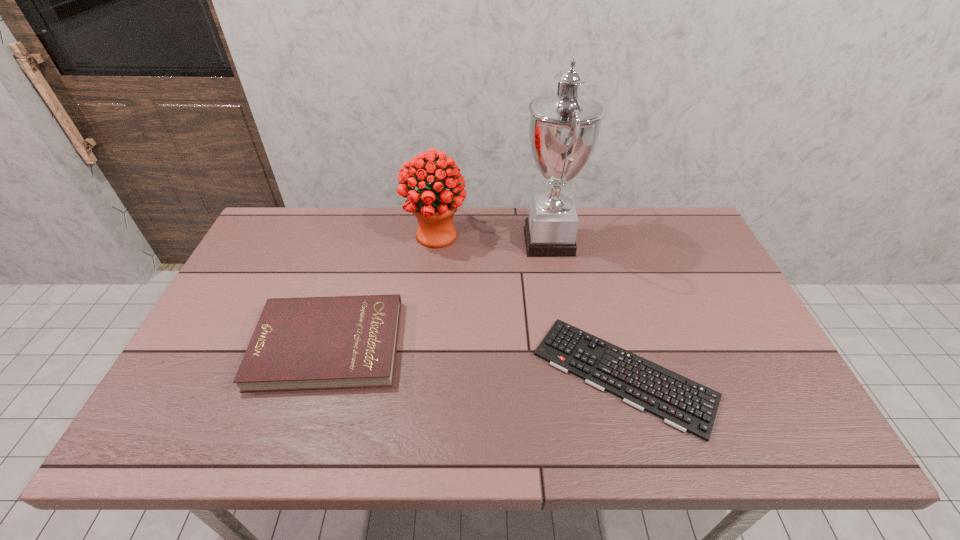
Identify the location of free space between the computer keyboard and the bouquet. The image size is (960, 540). (530, 305).

Choose which object is the third nearest neighbor to the trophy cup. Please provide its 2D coordinates. Your answer should be formatted as a tuple, i.e. [(x, y)], where the tuple contains the x and y coordinates of a point satisfying the conditions above.

[(307, 343)]

What are the coordinates of `object that is the closest to the hardback book` in the screenshot? It's located at (434, 206).

Locate an element on the screen. This screenshot has width=960, height=540. free space that satisfies the following two spatial constraints: 1. at the front view of the computer keyboard; 2. on the right side of the tallest object is located at coordinates (572, 375).

Locate an element on the screen. vacant point that satisfies the following two spatial constraints: 1. on the front side of the third shortest object; 2. on the left side of the shortest object is located at coordinates (420, 375).

You are a GUI agent. You are given a task and a screenshot of the screen. Output one action in this format:
    pyautogui.click(x=<x>, y=<y>)
    Task: Click on the free spot that satisfies the following two spatial constraints: 1. on the back side of the shortest object; 2. at the front view of the tallest object
    The image size is (960, 540).
    Given the screenshot: What is the action you would take?
    pyautogui.click(x=587, y=241)

This screenshot has width=960, height=540. I want to click on vacant space that satisfies the following two spatial constraints: 1. at the front view of the trophy cup; 2. on the right side of the shortest object, so click(x=572, y=375).

Locate an element on the screen. The image size is (960, 540). vacant region that satisfies the following two spatial constraints: 1. on the front side of the third tallest object; 2. on the left side of the shortest object is located at coordinates (319, 375).

At what (x,y) coordinates should I click in order to perform the action: click on vacant space that satisfies the following two spatial constraints: 1. at the front view of the trophy cup; 2. on the front side of the third tallest object. Please return your answer as a coordinate pair (x, y). Looking at the image, I should click on (567, 344).